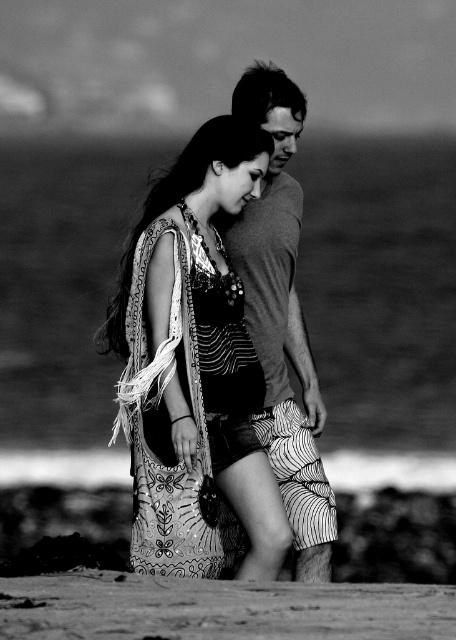
You are standing at the camera position and want to reach the point marked as point (141, 468) on the beach. If your walking speed is 1.5 meters per second, how many seconds will it take you to reach that point?

The point (141, 468) is 16.57 meters from the camera. At a speed of 1.5 meters per second, it would take approximately 11.05 seconds to reach it.